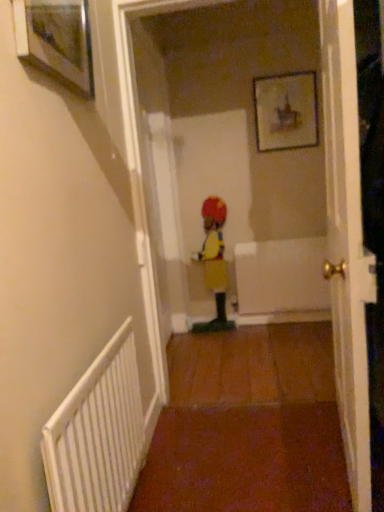
In order to face wooden framed picture at upper left, which ranks as the 2th picture frame in right-to-left order, should I rotate leftwards or rightwards?

Turn left approximately 16.611 degrees to face it.

Measure the distance between point [108,382] and camera.

They are 1.27 meters apart.

Find the location of a particular element. This screenshot has width=384, height=512. wooden framed picture at upper left, which ranks as the 2th picture frame in right-to-left order is located at coordinates (56, 40).

Considering the sizes of objects white textured radiator at lower left and wooden framed picture at upper left, acting as the 1th picture frame starting from the left, in the image provided, who is bigger, white textured radiator at lower left or wooden framed picture at upper left, acting as the 1th picture frame starting from the left,?

With larger size is white textured radiator at lower left.

Measure the distance between white textured radiator at lower left and wooden framed picture at upper left, acting as the first picture frame starting from the front.

white textured radiator at lower left is 38.58 inches from wooden framed picture at upper left, acting as the first picture frame starting from the front.

Is white textured radiator at lower left oriented away from wooden framed picture at upper left, the 2th picture frame from the back?

No, white textured radiator at lower left's orientation is not away from wooden framed picture at upper left, the 2th picture frame from the back.

Considering the relative sizes of white textured radiator at lower left and wooden framed picture at upper left, which ranks as the 2th picture frame in right-to-left order, in the image provided, is white textured radiator at lower left wider than wooden framed picture at upper left, which ranks as the 2th picture frame in right-to-left order,?

Correct, the width of white textured radiator at lower left exceeds that of wooden framed picture at upper left, which ranks as the 2th picture frame in right-to-left order.

Identify the location of door that appears in front of the yellow fabric clown at center. The height and width of the screenshot is (512, 384). (347, 242).

Is yellow fabric clown at center oriented away from white glossy door at center?

No, white glossy door at center is not at the back of yellow fabric clown at center.

Is yellow fabric clown at center not close to white glossy door at center?

yellow fabric clown at center is positioned a significant distance from white glossy door at center.

Which of these two, white textured radiator at lower left or wooden picture frame at upper center, the 2th picture frame when ordered from front to back, is wider?

Wider between the two is white textured radiator at lower left.

Does point (78, 415) appear closer or farther from the camera than point (289, 106)?

Point (78, 415) is closer to the camera than point (289, 106).

Is white textured radiator at lower left shorter than wooden picture frame at upper center, the first picture frame when ordered from back to front?

No, white textured radiator at lower left is not shorter than wooden picture frame at upper center, the first picture frame when ordered from back to front.

From a real-world perspective, relative to wooden framed picture at upper left, which ranks as the 2th picture frame in right-to-left order, is white glossy door at center vertically above or below?

white glossy door at center is below wooden framed picture at upper left, which ranks as the 2th picture frame in right-to-left order.

Is white glossy door at center positioned beyond the bounds of wooden framed picture at upper left, the 2th picture frame from the back?

Indeed, white glossy door at center is completely outside wooden framed picture at upper left, the 2th picture frame from the back.

Consider the image. Is white glossy door at center taller than wooden framed picture at upper left, acting as the first picture frame starting from the front?

Yes, white glossy door at center is taller than wooden framed picture at upper left, acting as the first picture frame starting from the front.

Considering the positions of point (333, 268) and point (33, 34), is point (333, 268) closer or farther from the camera than point (33, 34)?

Point (333, 268) is positioned farther from the camera compared to point (33, 34).

Is wooden framed picture at upper left, which ranks as the 2th picture frame in right-to-left order, to the right of yellow fabric clown at center from the viewer's perspective?

No.

In terms of height, does wooden framed picture at upper left, which ranks as the 2th picture frame in right-to-left order, look taller or shorter compared to yellow fabric clown at center?

Clearly, wooden framed picture at upper left, which ranks as the 2th picture frame in right-to-left order, is shorter compared to yellow fabric clown at center.

From the image's perspective, does wooden framed picture at upper left, which ranks as the 2th picture frame in right-to-left order, appear lower than yellow fabric clown at center?

Incorrect, from the image's perspective, wooden framed picture at upper left, which ranks as the 2th picture frame in right-to-left order, is higher than yellow fabric clown at center.

Could you tell me if wooden framed picture at upper left, acting as the 1th picture frame starting from the left, is facing yellow fabric clown at center?

No.

From a real-world perspective, who is located lower, wooden framed picture at upper left, which ranks as the 2th picture frame in right-to-left order, or white glossy door at center?

From a 3D spatial view, white glossy door at center is below.

Does wooden framed picture at upper left, which ranks as the 2th picture frame in right-to-left order, come in front of white glossy door at center?

No, it is behind white glossy door at center.

Can you confirm if wooden framed picture at upper left, acting as the first picture frame starting from the front, is bigger than white glossy door at center?

Incorrect, wooden framed picture at upper left, acting as the first picture frame starting from the front, is not larger than white glossy door at center.

From their relative heights in the image, would you say wooden framed picture at upper left, acting as the 1th picture frame starting from the left, is taller or shorter than white glossy door at center?

Considering their sizes, wooden framed picture at upper left, acting as the 1th picture frame starting from the left, has less height than white glossy door at center.

Measure the distance between wooden picture frame at upper center, the first picture frame when ordered from back to front, and white glossy door at center.

A distance of 5.07 feet exists between wooden picture frame at upper center, the first picture frame when ordered from back to front, and white glossy door at center.

Which point is more forward, (301, 93) or (340, 231)?

The point (340, 231) is in front.

Is wooden picture frame at upper center, the 2th picture frame when ordered from front to back, facing towards white glossy door at center?

Yes, wooden picture frame at upper center, the 2th picture frame when ordered from front to back, is aimed at white glossy door at center.

Which object is further away from the camera taking this photo, wooden picture frame at upper center, placed as the 1th picture frame when sorted from right to left, or white glossy door at center?

wooden picture frame at upper center, placed as the 1th picture frame when sorted from right to left, is behind.

Locate an element on the screen. This screenshot has width=384, height=512. picture frame that is the 1st one when counting upward from the white textured radiator at lower left (from the image's perspective) is located at coordinates (56, 40).

The width and height of the screenshot is (384, 512). I want to click on person located on the left of white glossy door at center, so click(214, 263).

From the image, which object appears to be nearer to wooden framed picture at upper left, which ranks as the 2th picture frame in right-to-left order, wooden picture frame at upper center, the first picture frame when ordered from back to front, or white textured radiator at lower left?

The object closer to wooden framed picture at upper left, which ranks as the 2th picture frame in right-to-left order, is white textured radiator at lower left.

Which object lies nearer to the anchor point white glossy door at center, yellow fabric clown at center or white textured radiator at lower left?

white textured radiator at lower left.

Estimate the real-world distances between objects in this image. Which object is closer to wooden framed picture at upper left, the 2th picture frame from the back, wooden picture frame at upper center, placed as the 1th picture frame when sorted from right to left, or white glossy door at center?

The object closer to wooden framed picture at upper left, the 2th picture frame from the back, is white glossy door at center.

Looking at the image, which one is located further to yellow fabric clown at center, white glossy door at center or white textured radiator at lower left?

white textured radiator at lower left is positioned further to the anchor yellow fabric clown at center.

Based on their spatial positions, is white textured radiator at lower left or wooden framed picture at upper left, which ranks as the 2th picture frame in right-to-left order, closer to white glossy door at center?

Among the two, white textured radiator at lower left is located nearer to white glossy door at center.

Considering their positions, is white textured radiator at lower left positioned closer to wooden picture frame at upper center, which is the 2th picture frame from left to right, than yellow fabric clown at center?

Among the two, yellow fabric clown at center is located nearer to wooden picture frame at upper center, which is the 2th picture frame from left to right.

From the image, which object appears to be nearer to wooden framed picture at upper left, acting as the first picture frame starting from the front, white glossy door at center or white textured radiator at lower left?

Based on the image, white glossy door at center appears to be nearer to wooden framed picture at upper left, acting as the first picture frame starting from the front.

Estimate the real-world distances between objects in this image. Which object is closer to wooden picture frame at upper center, the 2th picture frame when ordered from front to back, yellow fabric clown at center or white glossy door at center?

The object closer to wooden picture frame at upper center, the 2th picture frame when ordered from front to back, is yellow fabric clown at center.

Identify the location of picture frame between white glossy door at center and wooden picture frame at upper center, the 2th picture frame when ordered from front to back, from front to back. (x=56, y=40).

Where is `door between wooden framed picture at upper left, acting as the first picture frame starting from the front, and white textured radiator at lower left in the up-down direction`? door between wooden framed picture at upper left, acting as the first picture frame starting from the front, and white textured radiator at lower left in the up-down direction is located at coordinates (347, 242).

At what (x,y) coordinates should I click in order to perform the action: click on door between white textured radiator at lower left and wooden picture frame at upper center, the first picture frame when ordered from back to front, from front to back. Please return your answer as a coordinate pair (x, y). Image resolution: width=384 pixels, height=512 pixels. Looking at the image, I should click on point(347,242).

Where is `picture frame between wooden framed picture at upper left, which ranks as the 2th picture frame in right-to-left order, and yellow fabric clown at center from front to back`? picture frame between wooden framed picture at upper left, which ranks as the 2th picture frame in right-to-left order, and yellow fabric clown at center from front to back is located at coordinates (286, 111).